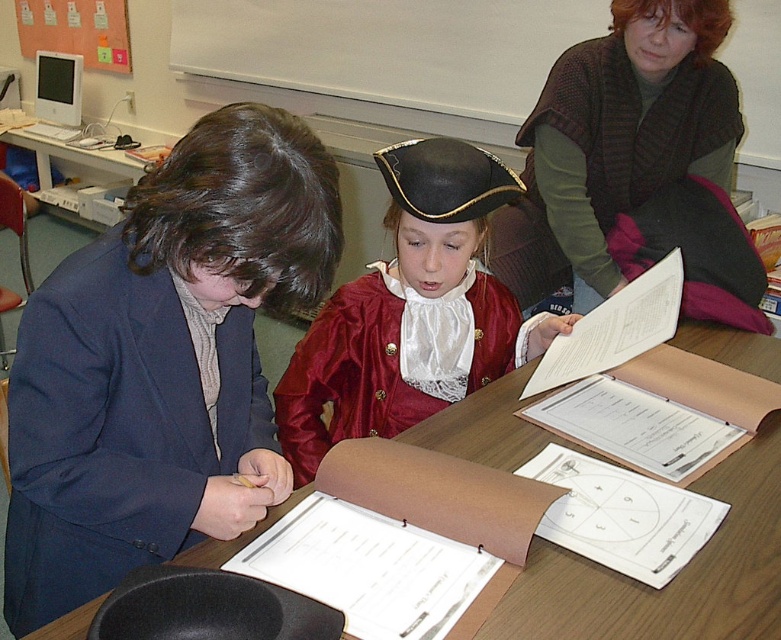
Question: Which of these objects is positioned farthest from the wooden table at center?

Choices:
 (A) blue fabric jacket at left
 (B) green sweater at upper right
 (C) shiny red coat at center

Answer: (B)

Question: Is blue fabric jacket at left bigger than shiny red coat at center?

Choices:
 (A) yes
 (B) no

Answer: (B)

Question: Which of the following is the closest to the observer?

Choices:
 (A) green sweater at upper right
 (B) blue fabric jacket at left

Answer: (B)

Question: Can you confirm if blue fabric jacket at left is positioned to the left of wooden table at center?

Choices:
 (A) no
 (B) yes

Answer: (B)

Question: Which object appears farthest from the camera in this image?

Choices:
 (A) green sweater at upper right
 (B) blue fabric jacket at left
 (C) wooden table at center
 (D) shiny red coat at center

Answer: (A)

Question: Does green sweater at upper right come in front of wooden table at center?

Choices:
 (A) no
 (B) yes

Answer: (A)